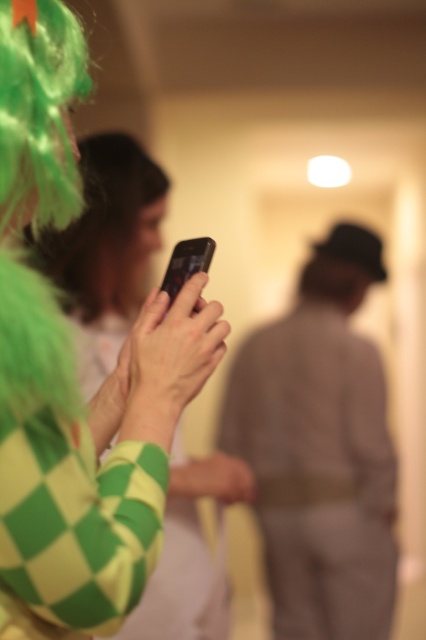
Question: Is light brown fabric suit at center above black glossy smartphone at center?

Choices:
 (A) yes
 (B) no

Answer: (B)

Question: Does light brown fabric suit at center appear on the left side of green feathered wig at upper left?

Choices:
 (A) no
 (B) yes

Answer: (A)

Question: Is light brown fabric suit at center closer to the viewer compared to black glossy smartphone at center?

Choices:
 (A) no
 (B) yes

Answer: (A)

Question: Which point is closer to the camera?

Choices:
 (A) green checkered shirt at center
 (B) black glossy smartphone at center
 (C) light brown fabric suit at center

Answer: (B)

Question: Which object is positioned farthest from the black glossy smartphone at center?

Choices:
 (A) green checkered shirt at center
 (B) green checkered fabric at center
 (C) light brown fabric suit at center
 (D) green feathered wig at upper left

Answer: (C)

Question: Among these points, which one is farthest from the camera?

Choices:
 (A) (169, 305)
 (B) (350, 397)
 (C) (150, 221)

Answer: (B)